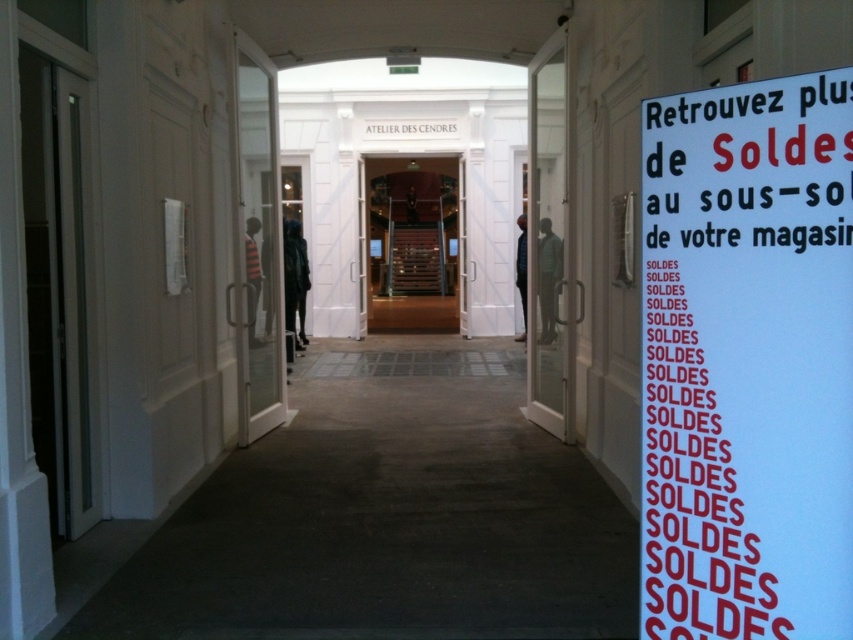
You are standing in the hallway and want to exit through the transparent glass door at left. Is the blue paper sign at right blocking your path?

The blue paper sign at right is positioned under the transparent glass door at left, so it is below the door and not blocking your path. You can exit through the transparent glass door at left without any obstruction.

What is the location of the point with coordinates (747,362) in the image?

The point with coordinates (747,362) corresponds to the blue paper sign at right.

You are a delivery person carrying a package that is 3 meters long. You need to move through the hallway and pass between the transparent glass door at left and the clear glass door at center. Can your package fit through the space between them?

The transparent glass door at left is 2.79 meters from the clear glass door at center. Since the package is 3 meters long, it is longer than the available space between the doors. Therefore, the package cannot fit through the space between the transparent glass door at left and the clear glass door at center.